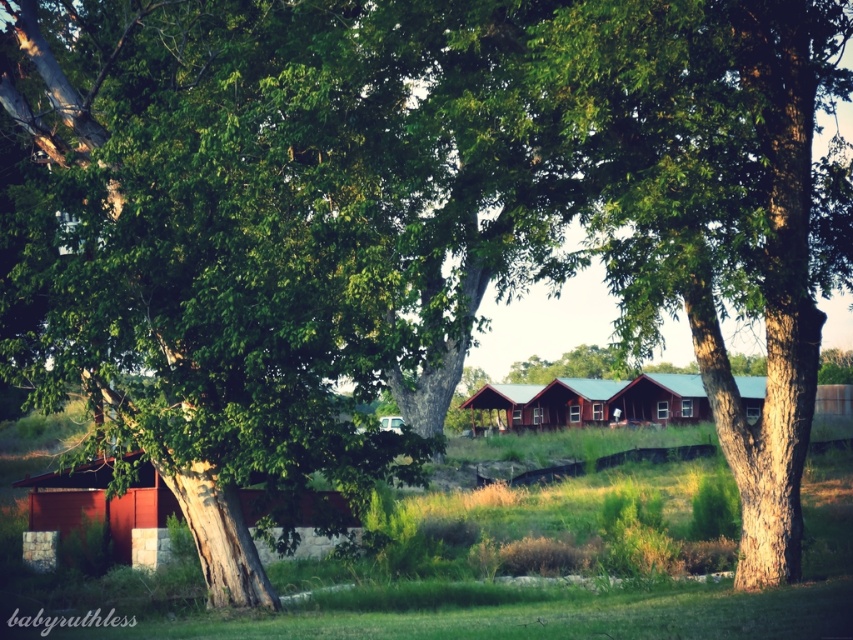
Is matte red cabin at lower left above green wooden cabin at center?

No.

Based on the photo, does matte red cabin at lower left appear under green wooden cabin at center?

Correct, matte red cabin at lower left is located below green wooden cabin at center.

The height and width of the screenshot is (640, 853). Describe the element at coordinates (105, 509) in the screenshot. I see `matte red cabin at lower left` at that location.

Identify the location of matte red cabin at lower left. Image resolution: width=853 pixels, height=640 pixels. (105, 509).

Does matte red cabin at center lie behind green wooden cabin at center?

No.

How far apart are matte red cabin at center and green wooden cabin at center?

5.66 meters

Locate an element on the screen. The image size is (853, 640). matte red cabin at center is located at coordinates (662, 397).

Is matte red cabin at lower left to the right of metallic red cabin at center from the viewer's perspective?

No, matte red cabin at lower left is not to the right of metallic red cabin at center.

Between point (90, 476) and point (534, 392), which one is positioned behind?

Point (534, 392)

Which is in front, point (317, 497) or point (497, 392)?

Point (317, 497)

Find the location of a particular element. matte red cabin at lower left is located at coordinates point(105,509).